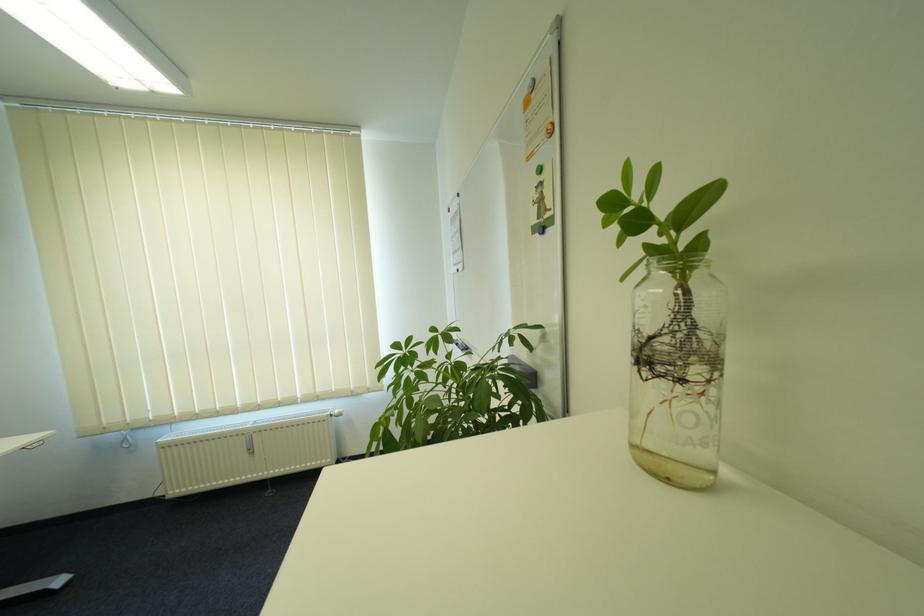
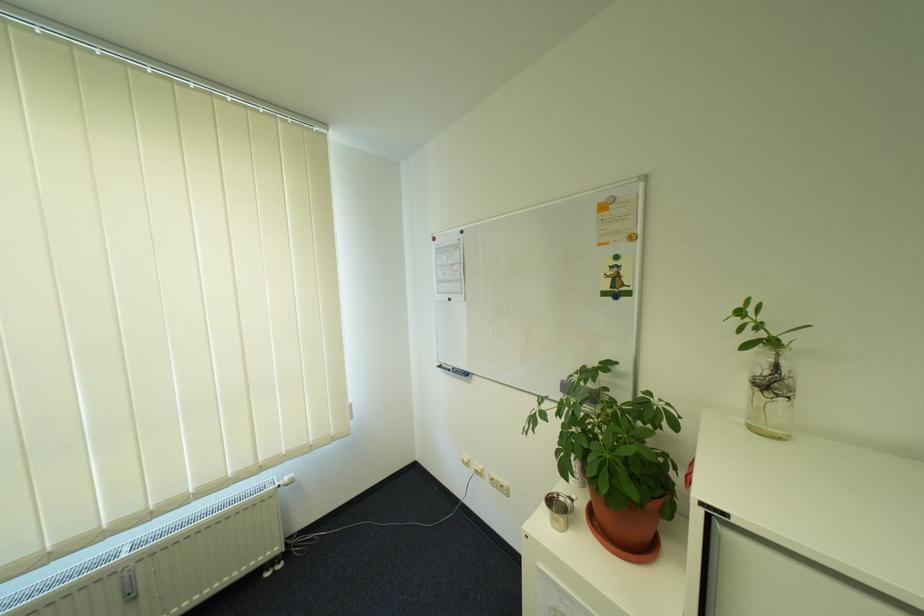
Question: The images are taken continuously from a first-person perspective. In which direction is your viewpoint rotating?

Choices:
 (A) Left
 (B) Right
 (C) Up
 (D) Down

Answer: (B)